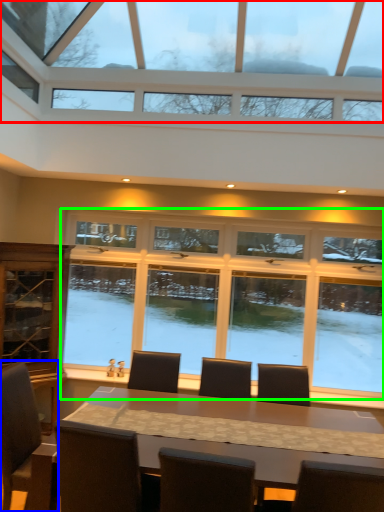
Question: Estimate the real-world distances between objects in this image. Which object is farther from window (highlighted by a red box), chair (highlighted by a blue box) or window (highlighted by a green box)?

Choices:
 (A) chair
 (B) window

Answer: (A)